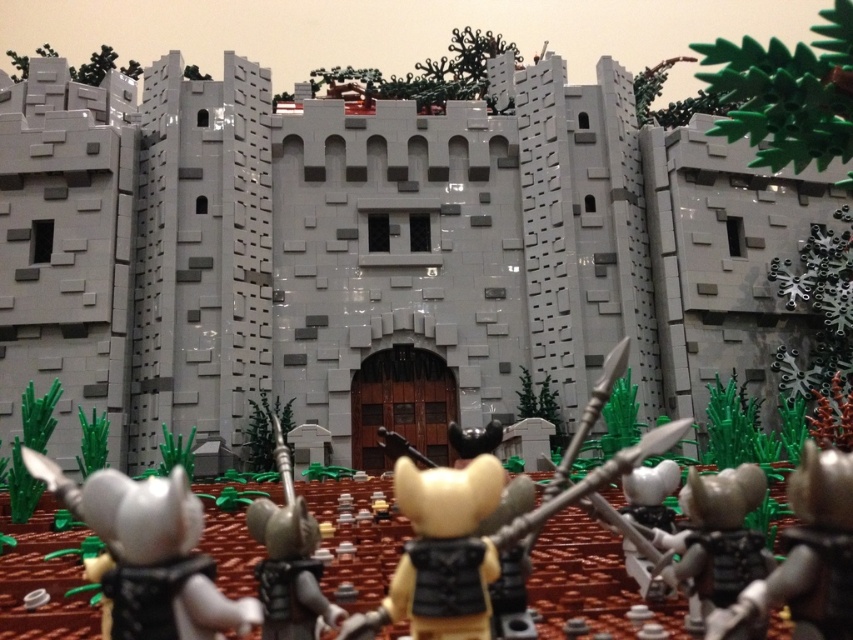
You are a knight approaching the castle from the front. You see the white matte axe at lower left and the metallic silver spear at center. Which weapon is closer to you as you approach the castle?

The white matte axe at lower left is closer to the viewer than the metallic silver spear at center, so the axe is closer to you as you approach the castle.

You are a knight in the LEGO castle scene. You need to retrieve your weapon. Which weapon is positioned higher, the white matte axe at lower left or the metallic silver spear at center?

The white matte axe at lower left is positioned higher than the metallic silver spear at center according to the description.

You are a knight in the LEGO castle scene. You need to retrieve the metallic silver armor at lower right but must first pick up the white matte axe at lower left. Given that your movement speed is 1 meter per second, how many seconds will it take you to reach the armor after starting from the axe?

The distance between the white matte axe at lower left and the metallic silver armor at lower right is 23.08 meters. Since you move at 1 meter per second, it will take 23.08 seconds to reach the armor.